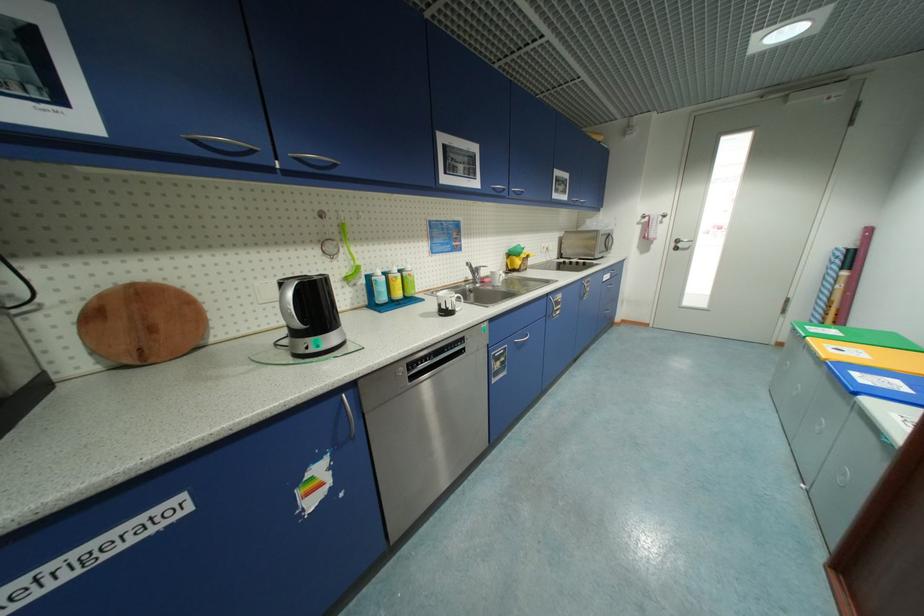
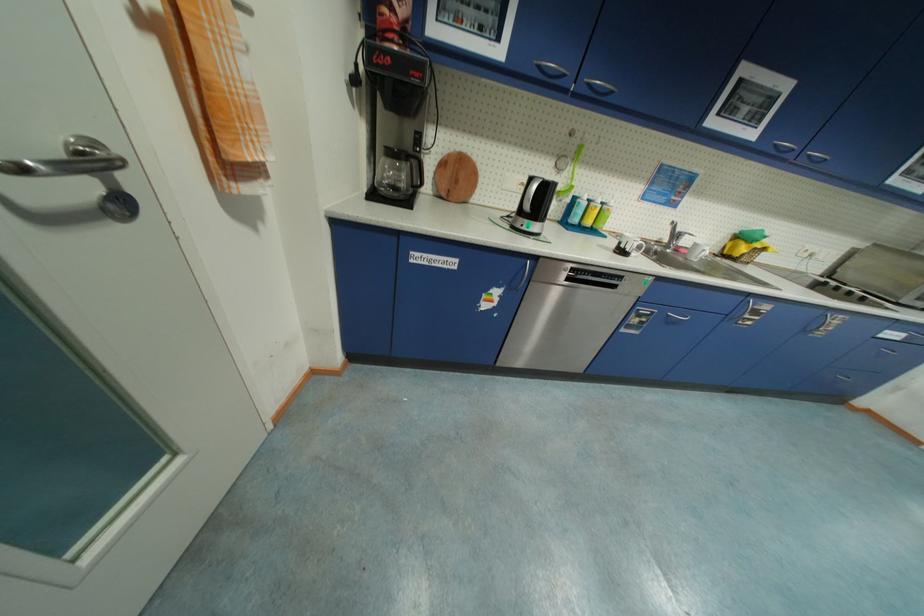
In the second image, find the point that corresponds to pixel 305 160 in the first image.

(594, 86)